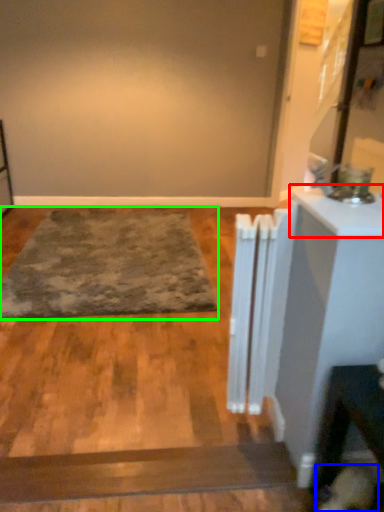
Question: Considering the real-world distances, which object is closest to counter top (highlighted by a red box)? dog (highlighted by a blue box) or mat (highlighted by a green box).

Choices:
 (A) dog
 (B) mat

Answer: (A)